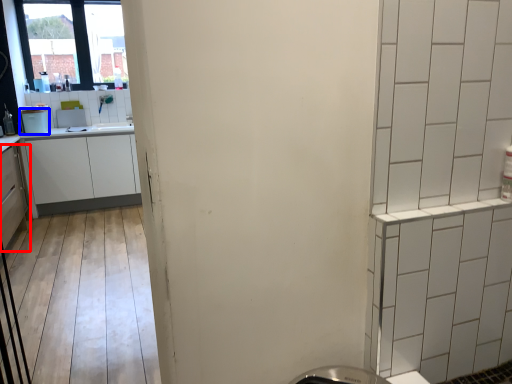
Question: Which of the following is the closest to the observer, cabinetry (highlighted by a red box) or appliance (highlighted by a blue box)?

Choices:
 (A) cabinetry
 (B) appliance

Answer: (A)